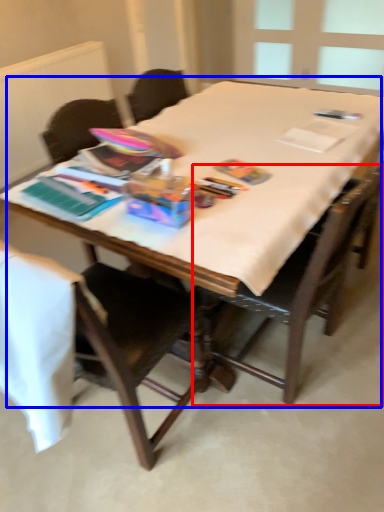
Question: Which of the following is the closest to the observer, chair (highlighted by a red box) or table (highlighted by a blue box)?

Choices:
 (A) chair
 (B) table

Answer: (A)